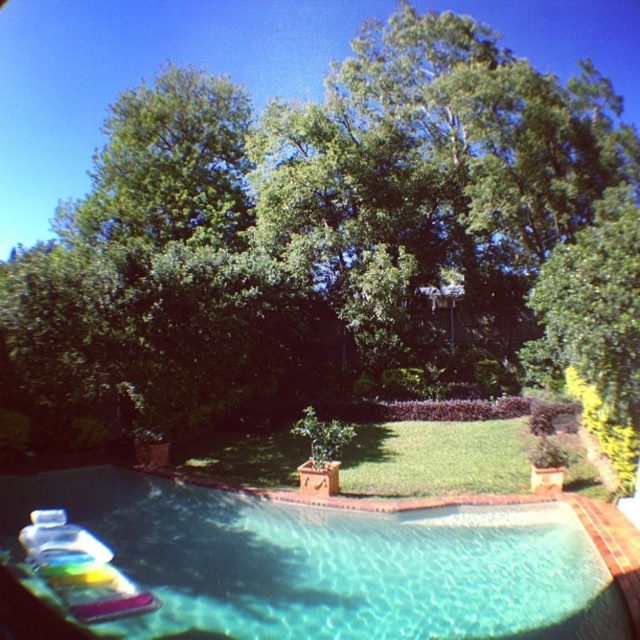
You are standing at the edge of the clear glass pool at lower center and want to look towards the green leafy tree at upper center. In which direction should you turn your head?

The green leafy tree at upper center is to the left of the clear glass pool at lower center, so you should turn your head to the left to look towards it.

You are standing in the backyard looking at the swimming pool. There is a point marked at coordinates (307, 236). Which object does this point belong to?

The point at coordinates (307, 236) is on the green leafy tree at upper center.